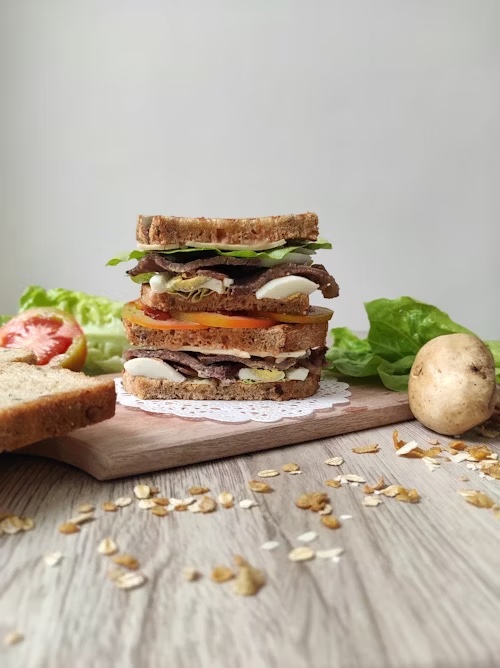
You are a GUI agent. You are given a task and a screenshot of the screen. Output one action in this format:
    pyautogui.click(x=<x>, y=<y>)
    Task: Click on the wall
    This screenshot has width=500, height=668.
    Given the screenshot: What is the action you would take?
    pyautogui.click(x=389, y=120)